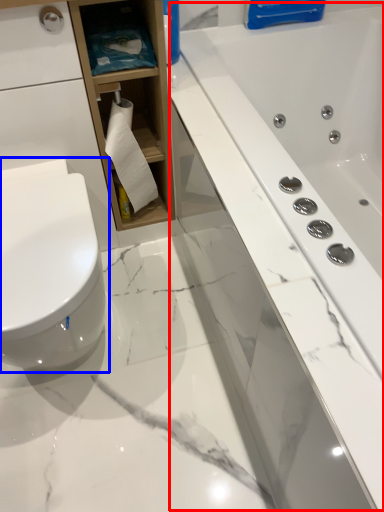
Question: Which point is closer to the camera, bath (highlighted by a red box) or toilet (highlighted by a blue box)?

Choices:
 (A) bath
 (B) toilet

Answer: (A)